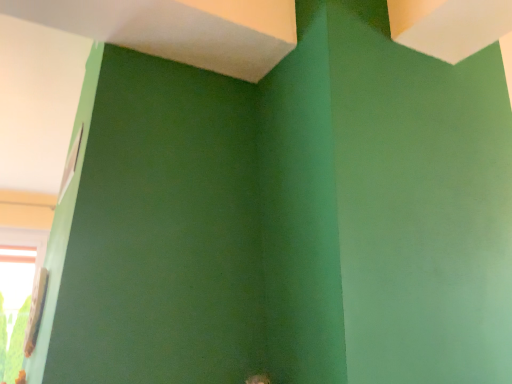
Based on the photo, measure the distance between point (5, 244) and camera.

4.21 meters.

This screenshot has width=512, height=384. What do you see at coordinates (17, 293) in the screenshot? I see `wooden frame at lower left` at bounding box center [17, 293].

The width and height of the screenshot is (512, 384). Identify the location of wooden frame at lower left. (17, 293).

What is the approximate width of wooden frame at lower left?

It is 9.70 centimeters.

The width and height of the screenshot is (512, 384). What are the coordinates of `wooden frame at lower left` in the screenshot? It's located at (17, 293).